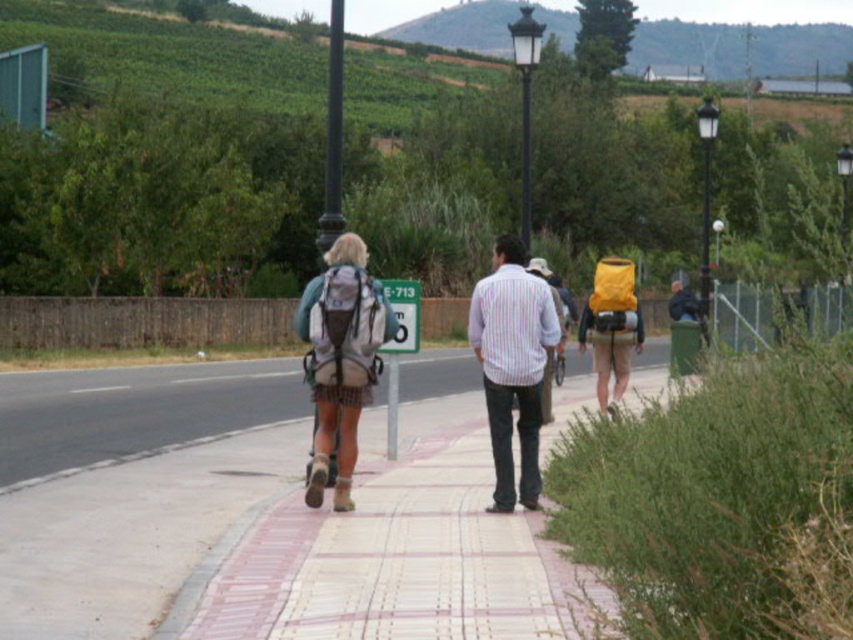
Question: Estimate the real-world distances between objects in this image. Which object is farther from the striped cotton shirt at center?

Choices:
 (A) matte gray backpack at center
 (B) paved sidewalk at center

Answer: (B)

Question: Is striped cotton shirt at center behind matte gray backpack at center?

Choices:
 (A) no
 (B) yes

Answer: (B)

Question: Which object appears closest to the camera in this image?

Choices:
 (A) paved sidewalk at center
 (B) striped cotton shirt at center

Answer: (A)

Question: From the image, what is the correct spatial relationship of paved sidewalk at center in relation to green plastic sign at center?

Choices:
 (A) right
 (B) left

Answer: (A)

Question: Estimate the real-world distances between objects in this image. Which object is closer to the matte gray backpack at center?

Choices:
 (A) paved sidewalk at center
 (B) striped cotton shirt at center

Answer: (B)

Question: Can you confirm if paved sidewalk at center is positioned below matte gray backpack at center?

Choices:
 (A) yes
 (B) no

Answer: (A)